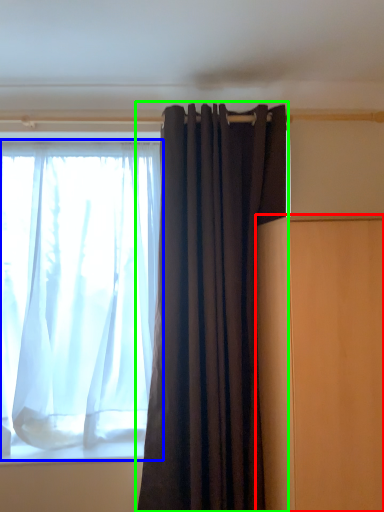
Question: Which object is positioned farthest from furniture (highlighted by a red box)? Select from curtain (highlighted by a blue box) and curtain (highlighted by a green box).

Choices:
 (A) curtain
 (B) curtain

Answer: (A)